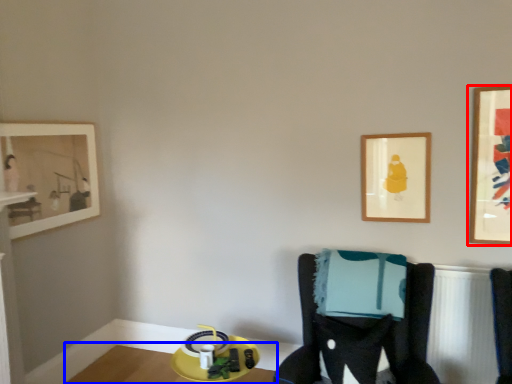
Question: Which object is closer to the camera taking this photo, picture frame (highlighted by a red box) or table (highlighted by a blue box)?

Choices:
 (A) picture frame
 (B) table

Answer: (A)